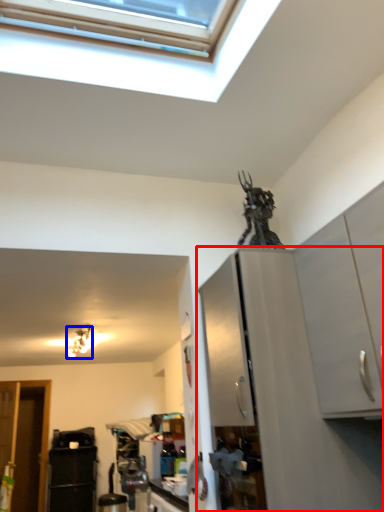
Question: Which object appears closest to the camera in this image, cabinetry (highlighted by a red box) or light fixture (highlighted by a blue box)?

Choices:
 (A) cabinetry
 (B) light fixture

Answer: (A)